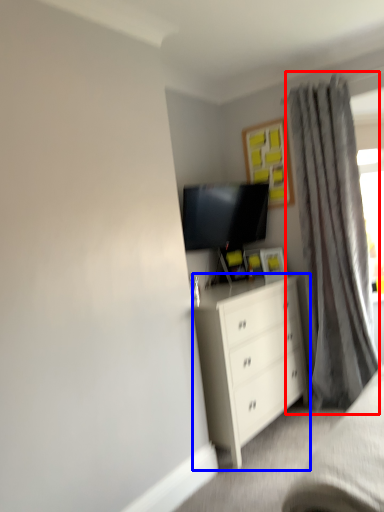
Question: Among these objects, which one is nearest to the camera, curtain (highlighted by a red box) or chest of drawers (highlighted by a blue box)?

Choices:
 (A) curtain
 (B) chest of drawers

Answer: (B)